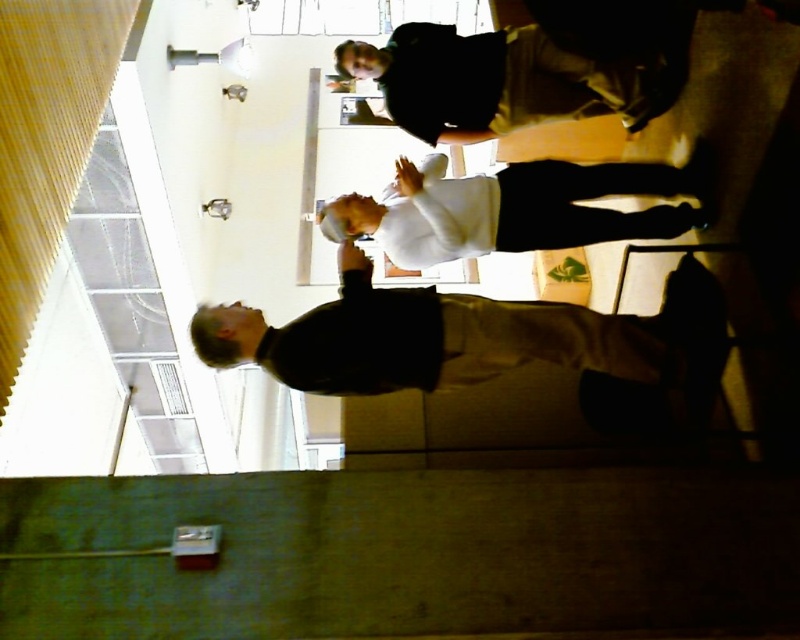
Question: Is dark gray sweater at center above white matte shirt at center?

Choices:
 (A) no
 (B) yes

Answer: (A)

Question: Can you confirm if dark gray sweater at center is smaller than white matte shirt at center?

Choices:
 (A) yes
 (B) no

Answer: (B)

Question: Which of the following is the farthest from the observer?

Choices:
 (A) white matte shirt at center
 (B) dark gray sweater at center

Answer: (A)

Question: Does dark gray sweater at center appear on the right side of white matte shirt at center?

Choices:
 (A) no
 (B) yes

Answer: (A)

Question: Which object is closer to the camera taking this photo?

Choices:
 (A) dark gray sweater at center
 (B) white matte shirt at center

Answer: (A)

Question: Which point is farther from the camera taking this photo?

Choices:
 (A) click(425, 298)
 (B) click(674, 228)

Answer: (B)